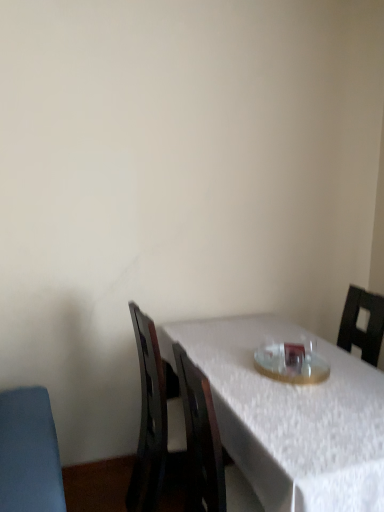
Where is `blank area to the left of clear glass plate at center`? This screenshot has height=512, width=384. blank area to the left of clear glass plate at center is located at coordinates (238, 373).